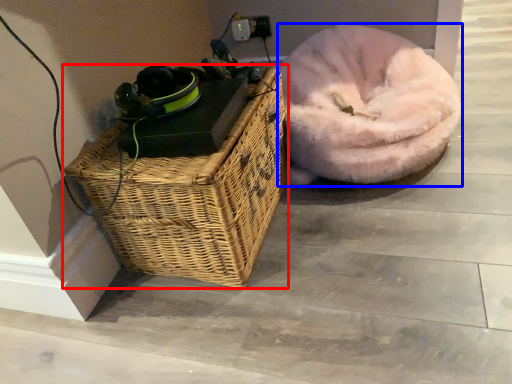
Question: Which point is closer to the camera, picnic basket (highlighted by a red box) or dog bed (highlighted by a blue box)?

Choices:
 (A) picnic basket
 (B) dog bed

Answer: (A)